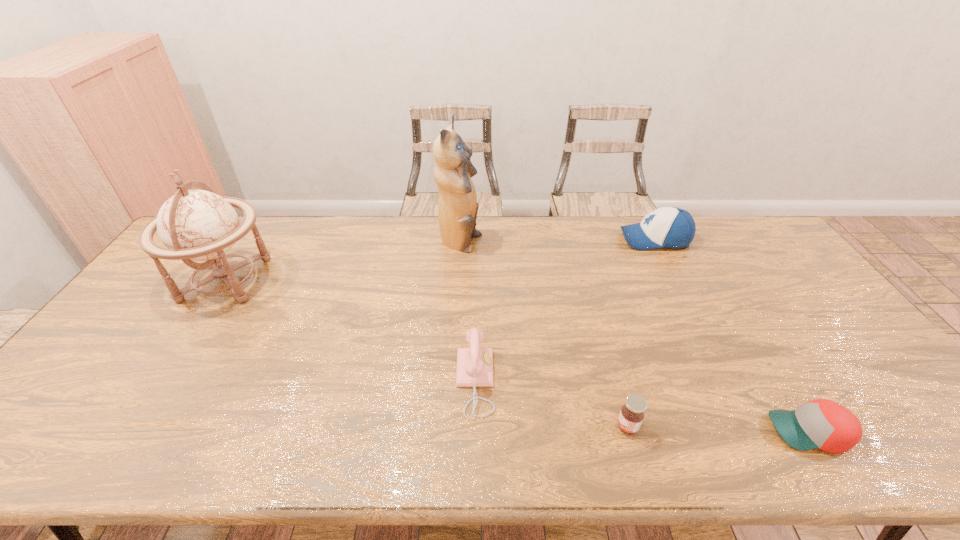
Where is `free space at the right edge`? free space at the right edge is located at coordinates (803, 323).

Find the location of a particular element. free area in between the telephone and the globe is located at coordinates (350, 330).

The image size is (960, 540). In order to click on vacant area between the fifth tallest object and the cat in this screenshot , I will do `click(543, 335)`.

Locate an element on the screen. vacant space in between the farther baseball cap and the leftmost object is located at coordinates (441, 259).

Where is `free spot between the second shortest object and the tallest object`? Image resolution: width=960 pixels, height=540 pixels. free spot between the second shortest object and the tallest object is located at coordinates (543, 335).

The image size is (960, 540). Find the location of `free space between the cat and the globe`. free space between the cat and the globe is located at coordinates click(x=343, y=261).

This screenshot has height=540, width=960. I want to click on unoccupied area between the jam and the farther baseball cap, so click(x=641, y=333).

The height and width of the screenshot is (540, 960). I want to click on free space that is in between the second shortest object and the tallest object, so click(543, 335).

Where is `vacant area that lies between the jam and the taller baseball cap`? vacant area that lies between the jam and the taller baseball cap is located at coordinates (641, 333).

The width and height of the screenshot is (960, 540). In order to click on vacant space in between the cat and the shortest object in this screenshot , I will do `click(635, 338)`.